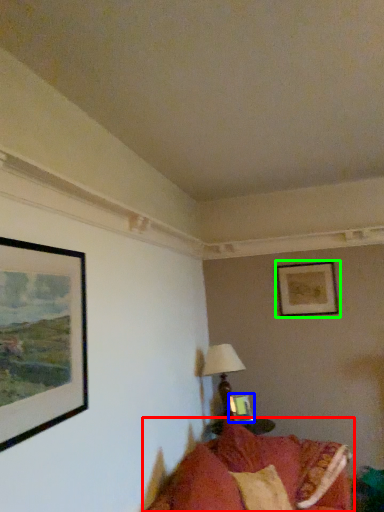
Question: Estimate the real-world distances between objects in this image. Which object is farther from studio couch (highlighted by a red box), picture frame (highlighted by a blue box) or picture frame (highlighted by a green box)?

Choices:
 (A) picture frame
 (B) picture frame

Answer: (B)